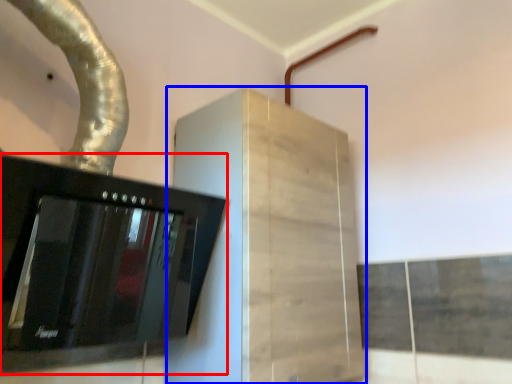
Question: Which of the following is the farthest to the observer, home appliance (highlighted by a red box) or cabinetry (highlighted by a blue box)?

Choices:
 (A) home appliance
 (B) cabinetry

Answer: (B)